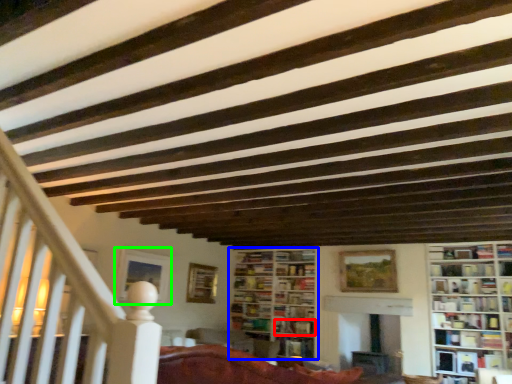
Question: Estimate the real-world distances between objects in this image. Which object is farther from book (highlighted by a red box), bookcase (highlighted by a blue box) or picture frame (highlighted by a green box)?

Choices:
 (A) bookcase
 (B) picture frame

Answer: (B)